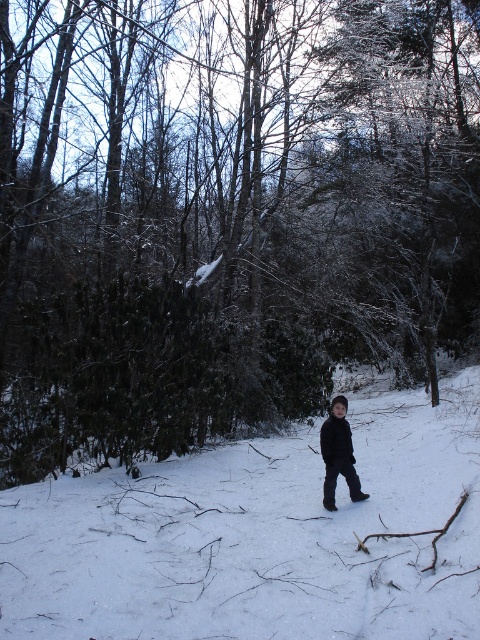
Can you confirm if white fluffy snow at center is smaller than black matte jacket at center?

No.

Can you confirm if white fluffy snow at center is positioned below black matte jacket at center?

Yes, white fluffy snow at center is below black matte jacket at center.

You are a GUI agent. You are given a task and a screenshot of the screen. Output one action in this format:
    pyautogui.click(x=<x>, y=<y>)
    Task: Click on the white fluffy snow at center
    Image resolution: width=480 pixels, height=640 pixels.
    Given the screenshot: What is the action you would take?
    pyautogui.click(x=260, y=536)

Find the location of a particular element. Image resolution: width=480 pixels, height=640 pixels. white fluffy snow at center is located at coordinates (260, 536).